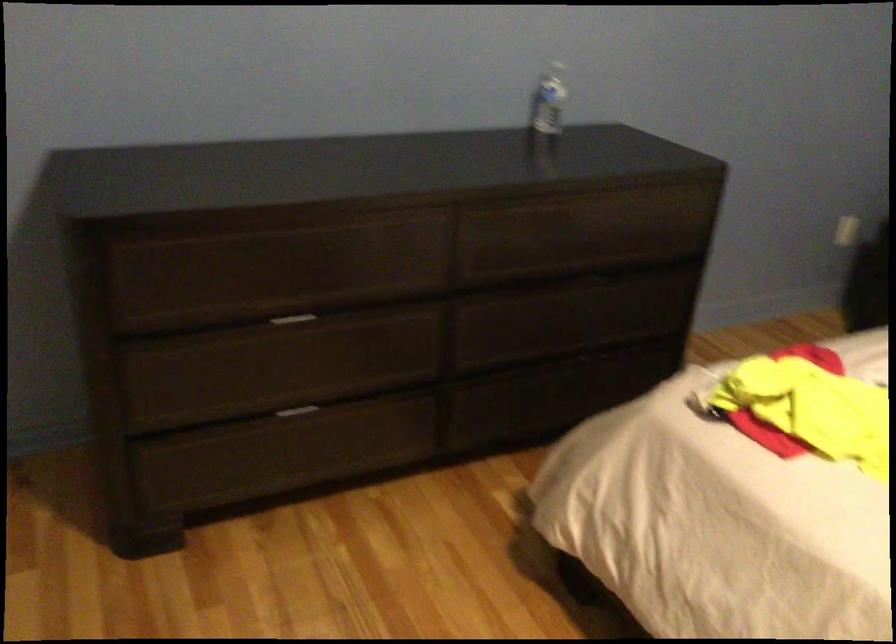
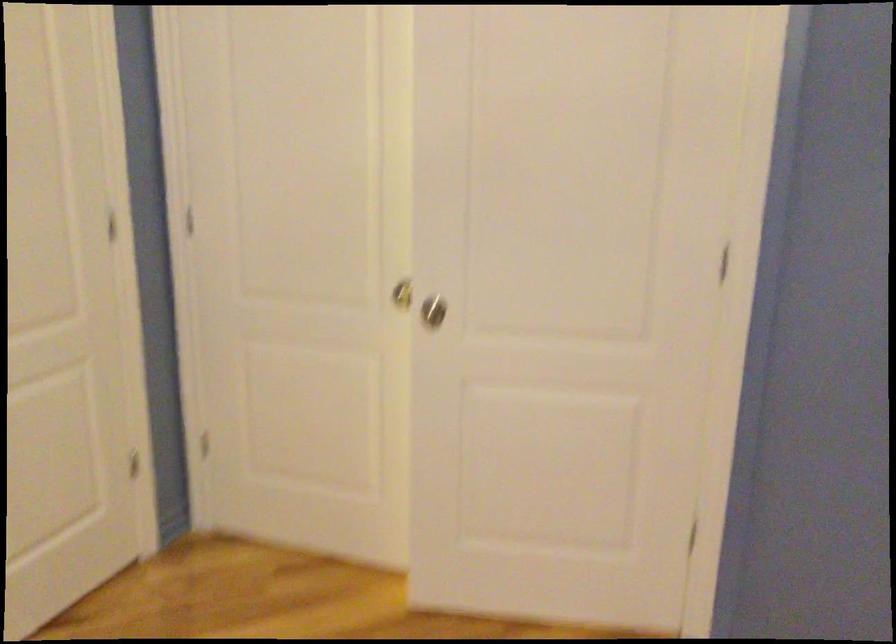
Question: The camera is either moving clockwise (left) or counter-clockwise (right) around the object. The first image is from the beginning of the video and the second image is from the end. Is the camera moving left or right when shooting the video?

Choices:
 (A) Left
 (B) Right

Answer: (B)